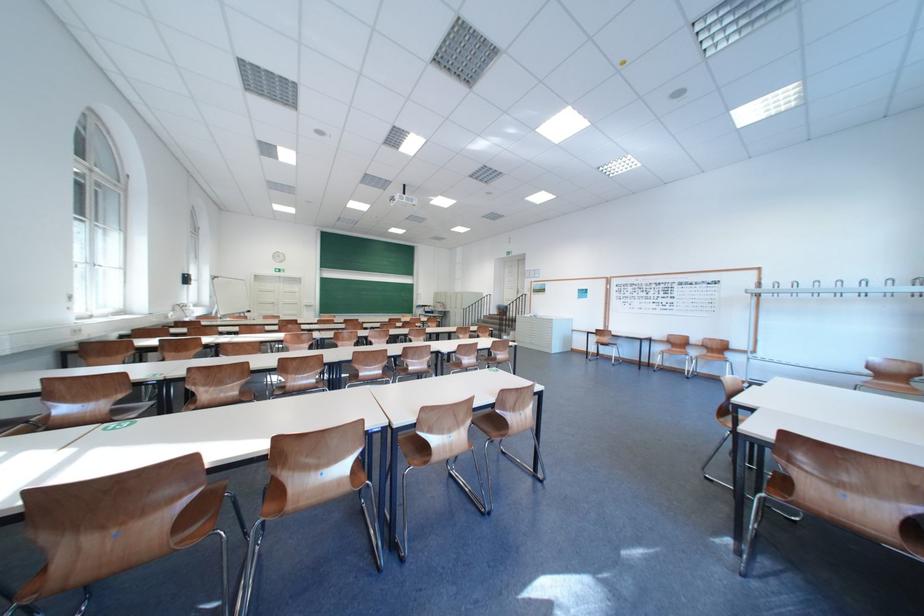
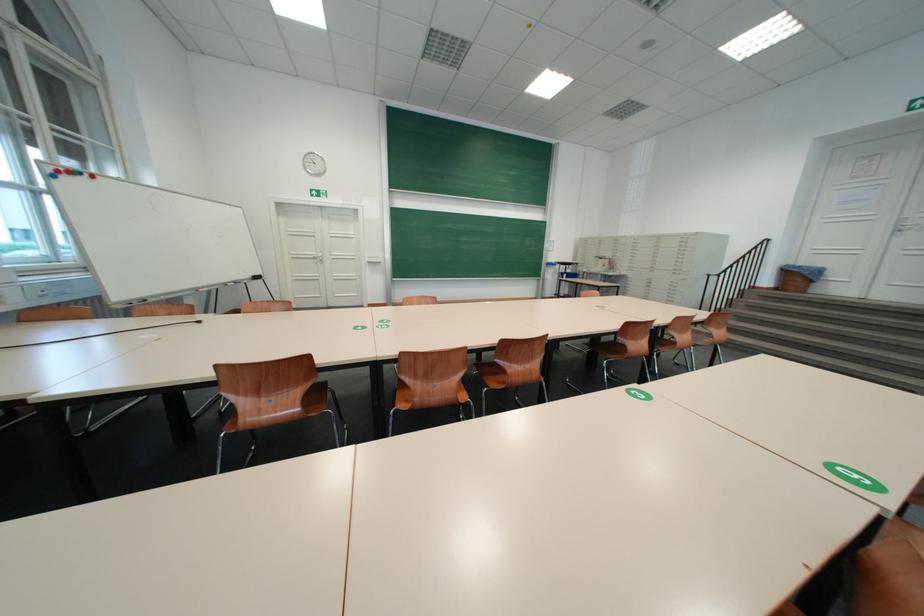
The point at (459,296) is marked in the first image. Where is the corresponding point in the second image?

(630, 241)